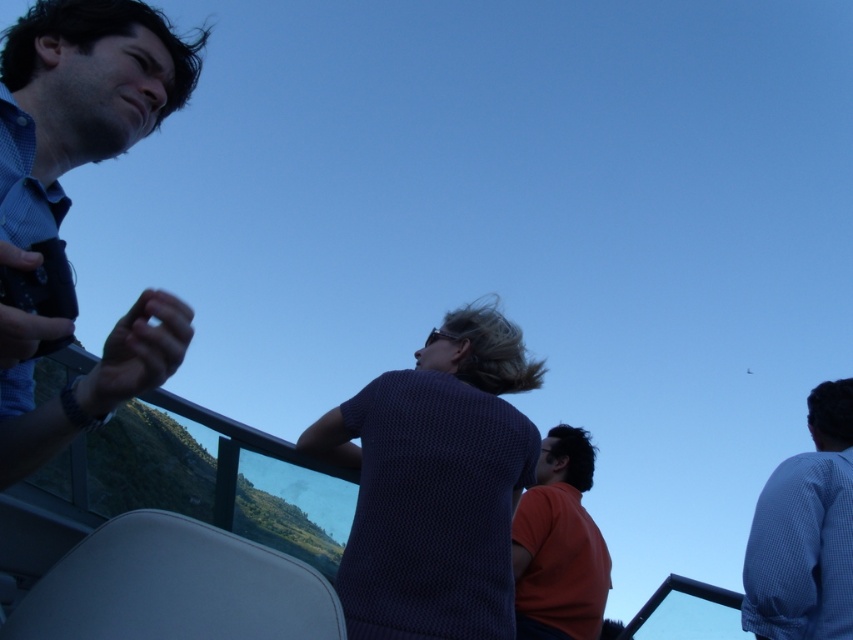
Does blue checkered shirt at upper right come behind orange matte shirt at center?

No, it is in front of orange matte shirt at center.

Can you confirm if blue checkered shirt at upper right is smaller than orange matte shirt at center?

Correct, blue checkered shirt at upper right occupies less space than orange matte shirt at center.

Is point (850, 394) closer to viewer compared to point (546, 513)?

Yes, point (850, 394) is in front of point (546, 513).

Locate an element on the screen. This screenshot has height=640, width=853. blue checkered shirt at upper right is located at coordinates (805, 532).

Does dark blue textured shirt at center have a lesser height compared to blue checkered shirt at upper left?

Yes, dark blue textured shirt at center is shorter than blue checkered shirt at upper left.

From the picture: Who is more forward, [396,465] or [144,22]?

Positioned in front is point [144,22].

Does point (361, 429) come closer to viewer compared to point (15, 477)?

No, it is not.

Identify the location of dark blue textured shirt at center. (434, 483).

Does point (15, 77) lie behind point (589, 444)?

No, it is not.

Can you confirm if blue checkered shirt at upper left is wider than orange matte shirt at center?

Yes, blue checkered shirt at upper left is wider than orange matte shirt at center.

Does point (94, 65) come closer to viewer compared to point (560, 483)?

That is True.

The width and height of the screenshot is (853, 640). Find the location of `blue checkered shirt at upper left`. blue checkered shirt at upper left is located at coordinates (79, 100).